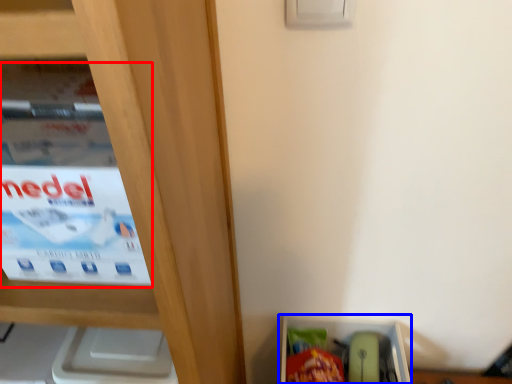
Question: Which point is closer to the camera, paperback book (highlighted by a red box) or storage box (highlighted by a blue box)?

Choices:
 (A) paperback book
 (B) storage box

Answer: (A)